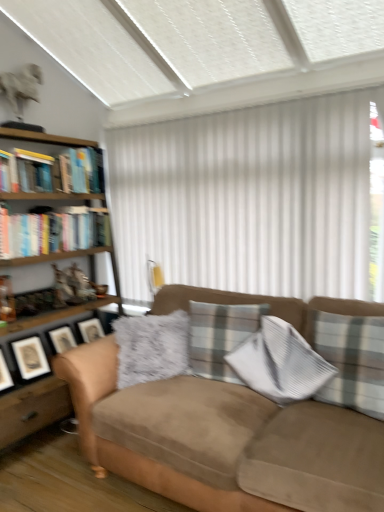
Question: From the image's perspective, is white vertical blinds at center below plaid fabric pillow at right, which appears as the first pillow when viewed from the right?

Choices:
 (A) yes
 (B) no

Answer: (B)

Question: Can you confirm if white vertical blinds at center is shorter than plaid fabric pillow at right, which is the second pillow from left to right?

Choices:
 (A) no
 (B) yes

Answer: (A)

Question: Is the surface of white vertical blinds at center in direct contact with plaid fabric pillow at right, which appears as the first pillow when viewed from the right?

Choices:
 (A) yes
 (B) no

Answer: (B)

Question: Would you say plaid fabric pillow at right, which appears as the first pillow when viewed from the right, is part of white vertical blinds at center's contents?

Choices:
 (A) no
 (B) yes

Answer: (A)

Question: Does white vertical blinds at center have a smaller size compared to plaid fabric pillow at right, which appears as the first pillow when viewed from the right?

Choices:
 (A) yes
 (B) no

Answer: (B)

Question: From the image's perspective, is white vertical blinds at center on plaid fabric pillow at right, which is the second pillow from left to right?

Choices:
 (A) no
 (B) yes

Answer: (B)

Question: From a real-world perspective, is plaid fabric pillow at center, marked as the 2th pillow in a right-to-left arrangement, below hardcover book at upper left, the fourth book in the bottom-to-top sequence?

Choices:
 (A) yes
 (B) no

Answer: (A)

Question: From the image's perspective, is plaid fabric pillow at center, which appears as the 1th pillow when viewed from the left, on top of hardcover book at upper left, which is the first book in top-to-bottom order?

Choices:
 (A) yes
 (B) no

Answer: (B)

Question: Is plaid fabric pillow at center, which appears as the 1th pillow when viewed from the left, at the right side of hardcover book at upper left, which is the first book in top-to-bottom order?

Choices:
 (A) yes
 (B) no

Answer: (A)

Question: Does plaid fabric pillow at center, which appears as the 1th pillow when viewed from the left, have a smaller size compared to hardcover book at upper left, which is the first book in top-to-bottom order?

Choices:
 (A) no
 (B) yes

Answer: (A)

Question: Could you tell me if plaid fabric pillow at center, which appears as the 1th pillow when viewed from the left, is facing hardcover book at upper left, which is the first book in top-to-bottom order?

Choices:
 (A) yes
 (B) no

Answer: (B)

Question: Does plaid fabric pillow at center, which appears as the 1th pillow when viewed from the left, have a greater width compared to hardcover book at upper left, which is the first book in top-to-bottom order?

Choices:
 (A) no
 (B) yes

Answer: (A)

Question: Does woodenmaterial/texturebookcase at left have a larger size compared to hardcover book at left, marked as the 2th book in a bottom-to-top arrangement?

Choices:
 (A) no
 (B) yes

Answer: (B)